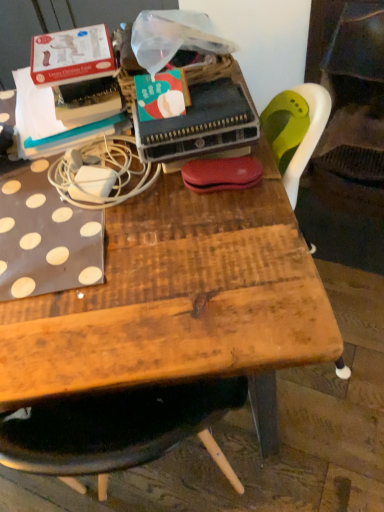
Question: Is white matte power adapter at upper left to the left or to the right of wooden table at center in the image?

Choices:
 (A) left
 (B) right

Answer: (A)

Question: Based on their sizes in the image, would you say white matte power adapter at upper left is bigger or smaller than wooden table at center?

Choices:
 (A) small
 (B) big

Answer: (A)

Question: Which is farther from the white matte power adapter at upper left?

Choices:
 (A) matte green paperback book at center
 (B) wooden table at center

Answer: (B)

Question: Which object is the closest to the white matte power adapter at upper left?

Choices:
 (A) matte green paperback book at center
 (B) wooden table at center

Answer: (A)